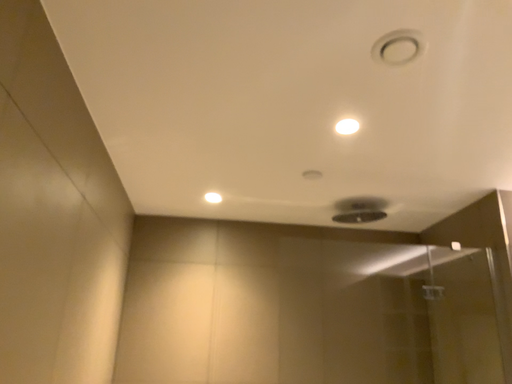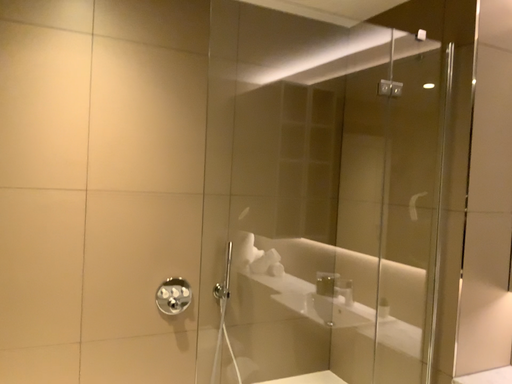
Question: Which way did the camera rotate in the video?

Choices:
 (A) rotated left
 (B) rotated right

Answer: (B)